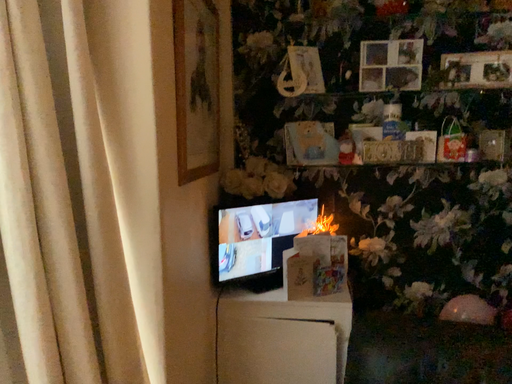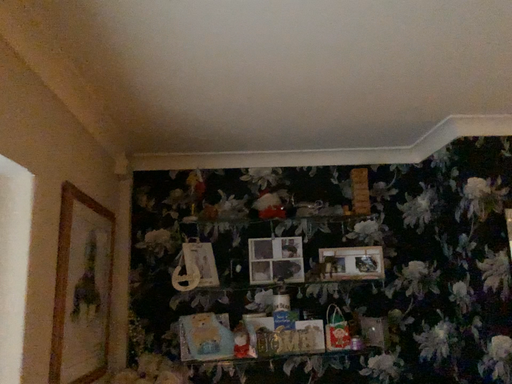
Question: How did the camera likely rotate when shooting the video?

Choices:
 (A) rotated left
 (B) rotated right

Answer: (B)